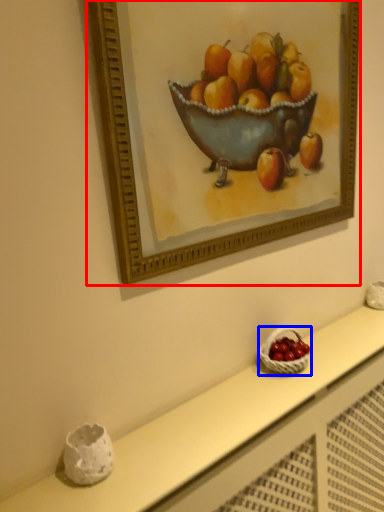
Question: Among these objects, which one is nearest to the camera, picture frame (highlighted by a red box) or basket (highlighted by a blue box)?

Choices:
 (A) picture frame
 (B) basket

Answer: (A)